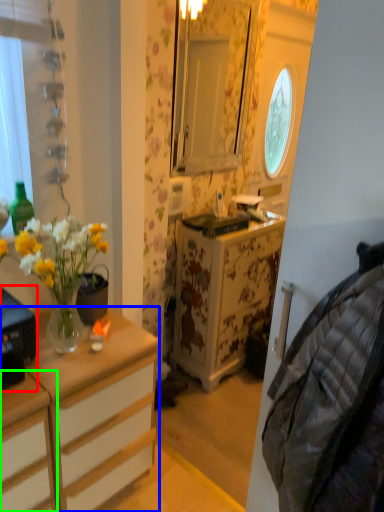
Question: Estimate the real-world distances between objects in this image. Which object is closer to desk (highlighted by a red box), cabinetry (highlighted by a blue box) or cabinetry (highlighted by a green box)?

Choices:
 (A) cabinetry
 (B) cabinetry

Answer: (B)